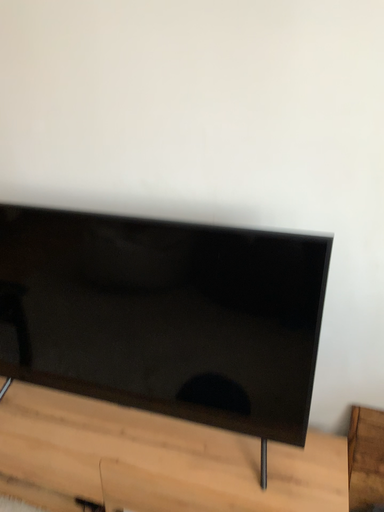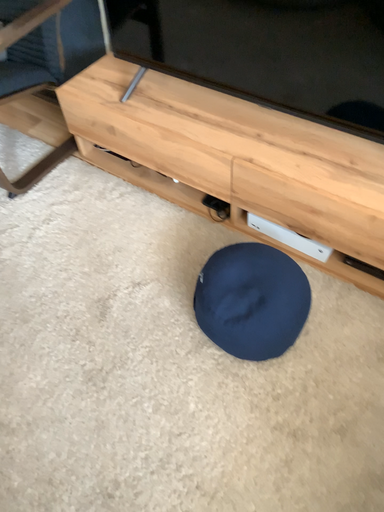
Question: Which way did the camera rotate in the video?

Choices:
 (A) rotated left
 (B) rotated right

Answer: (A)